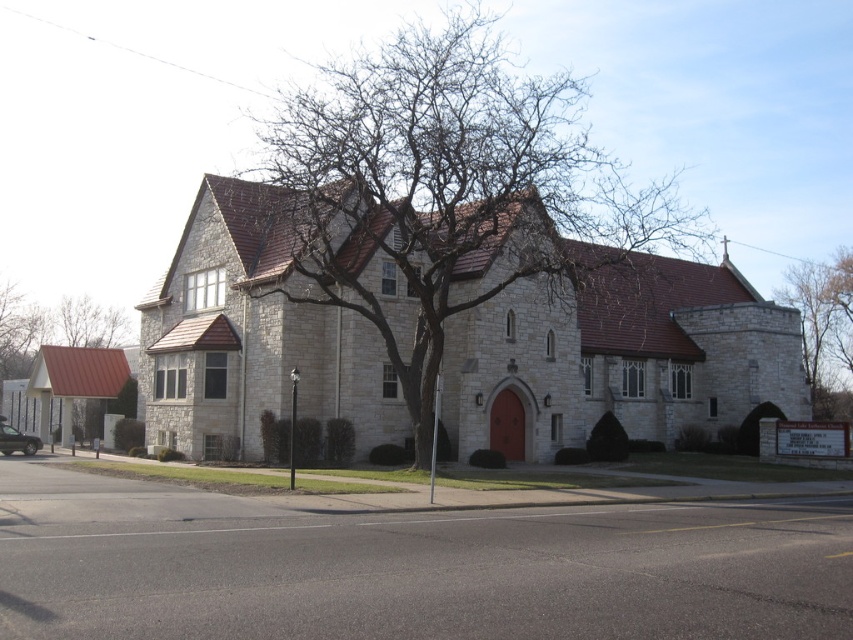
In the scene shown: You are a window cleaner with a 3 meter long ladder. You need to clean the brown textured roof at upper left and the bare branches at center. Which object requires you to place the ladder closer to its base?

The brown textured roof at upper left requires the ladder to be placed closer to its base because it is narrower than the bare branches at center, which might be wider. Since the ladder is 3 meters long, positioning it closer ensures stability and reach for the narrower roof area.

You are a painter setting up an easel to paint the church. You want to ensure the bare branches at center and the bare stone tree at upper right are both visible in your painting. Based on their widths, which object might require you to adjust your perspective to avoid blocking the other?

The bare branches at center might be wider than the bare stone tree at upper right, so you may need to adjust your perspective to ensure both are visible without one overshadowing the other.

You are a window cleaner who needs to clean the brown textured roof at upper left and the bare stone tree at upper right. Since you have a ladder that can reach up to 10 meters, can you safely clean both objects without needing a taller ladder?

The bare stone tree at upper right is taller than the brown textured roof at upper left. If the ladder can only reach up to 10 meters, you must determine the height of both objects. However, since the description only states the tree is taller than the roof but doesn